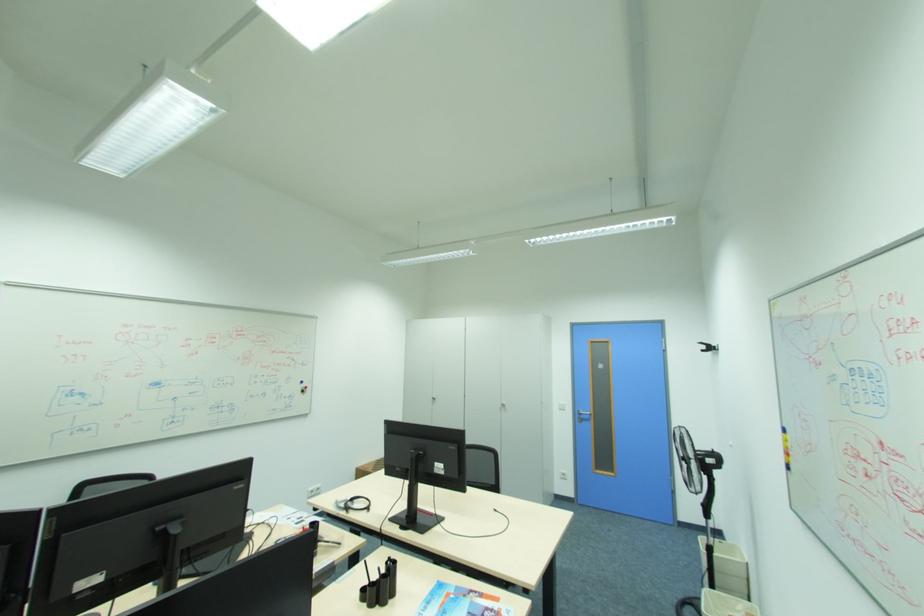
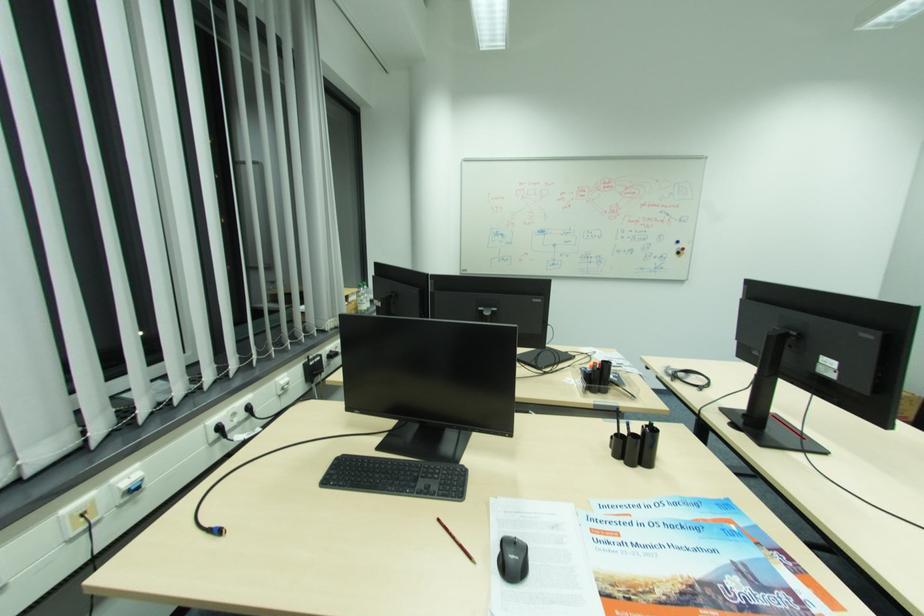
The point at (309,391) is marked in the first image. Where is the corresponding point in the second image?

(684, 253)